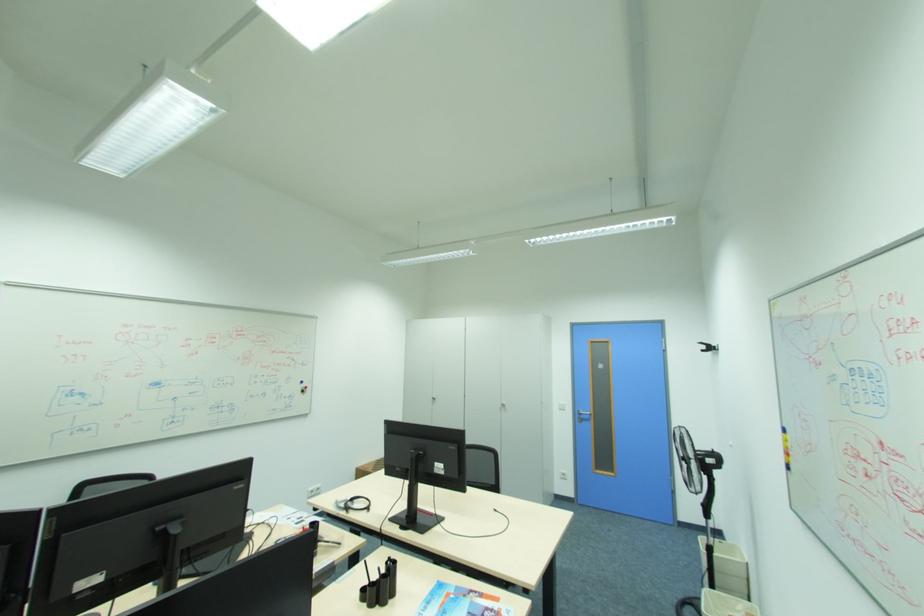
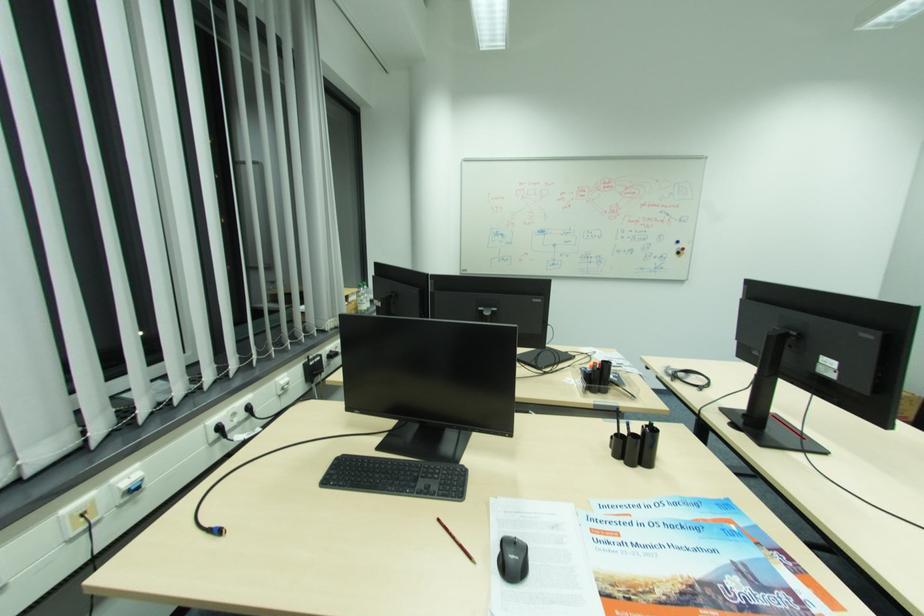
The point at (309,391) is marked in the first image. Where is the corresponding point in the second image?

(684, 253)